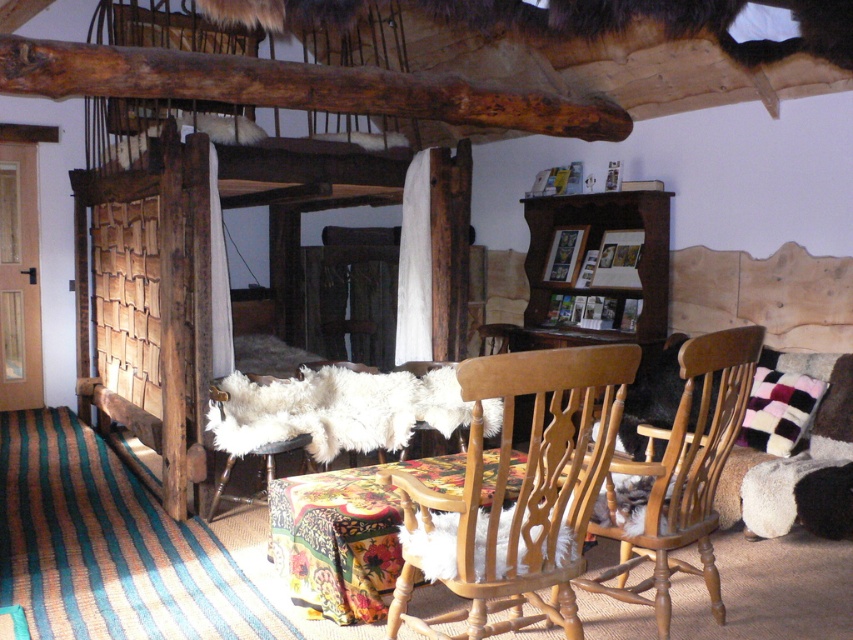
Question: Can you confirm if rustic wood bunk bed at center is positioned below floral fabric-covered table at center?

Choices:
 (A) yes
 (B) no

Answer: (B)

Question: Which object is positioned farthest from the wooden chair at center?

Choices:
 (A) light brown wood chair at center
 (B) floral fabric-covered table at center
 (C) rustic wood bunk bed at center

Answer: (C)

Question: Which is farther from the floral fabric-covered table at center?

Choices:
 (A) light brown wood chair at center
 (B) wooden chair at center

Answer: (B)

Question: Considering the real-world distances, which object is closest to the wooden chair at center?

Choices:
 (A) floral fabric-covered table at center
 (B) light brown wood chair at center
 (C) rustic wood bunk bed at center

Answer: (B)

Question: Does wooden chair at center appear under floral fabric-covered table at center?

Choices:
 (A) yes
 (B) no

Answer: (B)

Question: Does rustic wood bunk bed at center have a larger size compared to floral fabric-covered table at center?

Choices:
 (A) no
 (B) yes

Answer: (B)